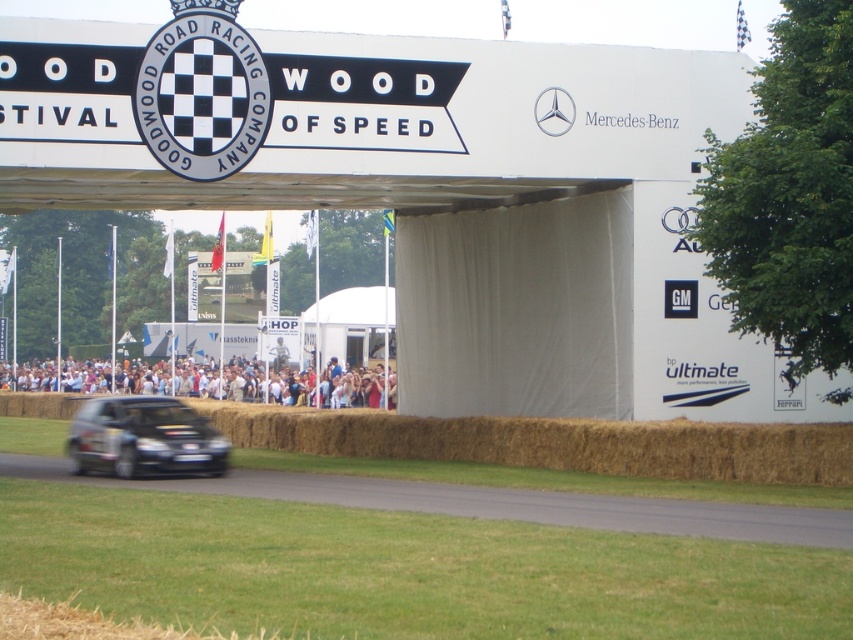
Between black asphalt road at lower center and light brown hair at lower center, which one has less height?

black asphalt road at lower center

Can you confirm if black asphalt road at lower center is positioned to the left of light brown hair at lower center?

In fact, black asphalt road at lower center is to the right of light brown hair at lower center.

Measure the distance between black asphalt road at lower center and camera.

The distance of black asphalt road at lower center from camera is 15.26 meters.

Identify the location of black asphalt road at lower center. pyautogui.click(x=492, y=502).

Who is lower down, black glossy hatchback at lower left or light brown hair at lower center?

black glossy hatchback at lower left

Is point (193, 445) less distant than point (357, 387)?

Yes.

The width and height of the screenshot is (853, 640). Find the location of `black glossy hatchback at lower left`. black glossy hatchback at lower left is located at coordinates (144, 438).

How much distance is there between black asphalt road at lower center and black glossy hatchback at lower left?

black asphalt road at lower center and black glossy hatchback at lower left are 5.02 meters apart from each other.

Can you confirm if black asphalt road at lower center is shorter than black glossy hatchback at lower left?

Yes, black asphalt road at lower center is shorter than black glossy hatchback at lower left.

The width and height of the screenshot is (853, 640). What are the coordinates of `black asphalt road at lower center` in the screenshot? It's located at (492, 502).

Locate an element on the screen. The image size is (853, 640). black asphalt road at lower center is located at coordinates (492, 502).